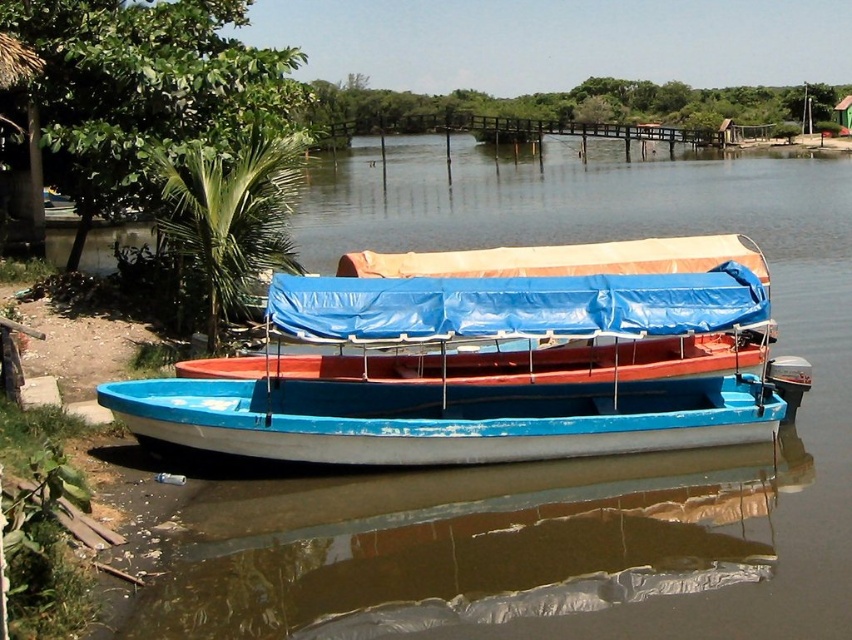
Based on the photo, between blue plastic boat at center and blue painted wood canoe at center, which one is positioned lower?

Positioned lower is blue painted wood canoe at center.

Where is `blue plastic boat at center`? blue plastic boat at center is located at coordinates (490, 360).

Locate an element on the screen. The height and width of the screenshot is (640, 852). blue plastic boat at center is located at coordinates (490, 360).